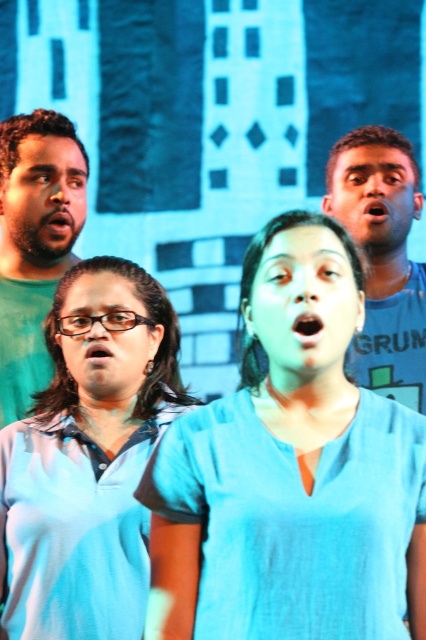
You are a photographer setting up for a group photo. You need to ensure that all members are visible. Given that there are two shirts at the center, the blue cotton shirt at center and the blue fabric shirt at center, which one should be moved forward to avoid being blocked by the other?

The blue cotton shirt at center should be moved forward because it is shorter than the blue fabric shirt at center, so moving it forward would prevent it from being blocked by the taller shirt.

You are directing a stage performance and need to adjust the spotlight positions. The blue fabric shirt at center and the matte green shirt at left are part of the cast. Which performer should you focus the spotlight on first if you want to highlight the one closer to the audience?

The blue fabric shirt at center should be focused on first because it is in front of the matte green shirt at left, making it closer to the audience.